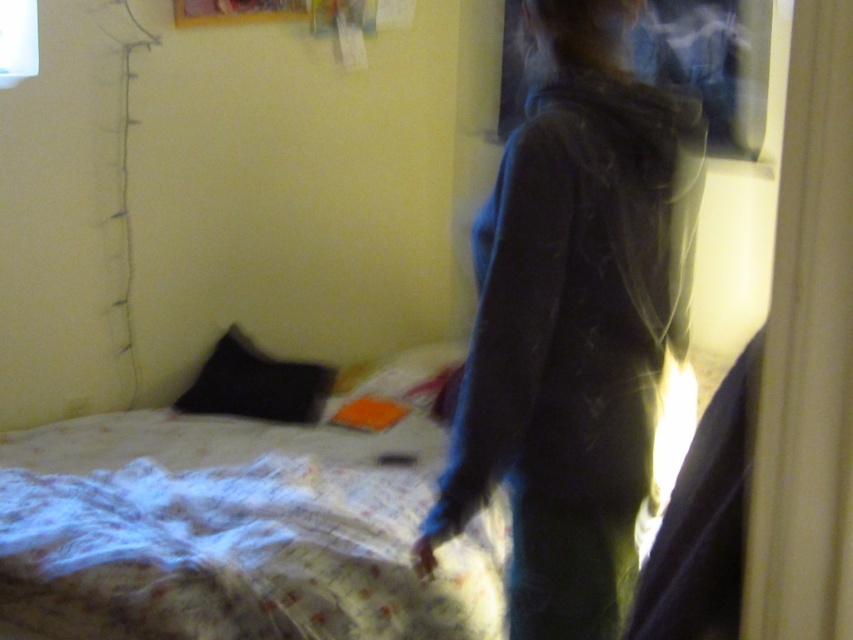
Question: Which of the following is the farthest from the observer?

Choices:
 (A) (657, 227)
 (B) (413, 612)

Answer: (B)

Question: Is the position of dark blue hoodie at center more distant than that of white textured bed at center?

Choices:
 (A) no
 (B) yes

Answer: (A)

Question: Is dark blue hoodie at center behind white textured bed at center?

Choices:
 (A) no
 (B) yes

Answer: (A)

Question: Is dark blue hoodie at center bigger than white textured bed at center?

Choices:
 (A) no
 (B) yes

Answer: (A)

Question: Which point is farther to the camera?

Choices:
 (A) white textured bed at center
 (B) dark blue hoodie at center

Answer: (A)